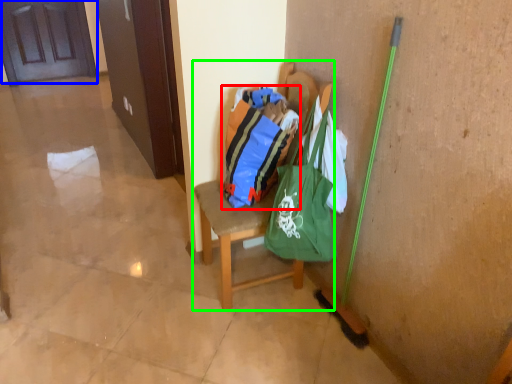
Question: Which object is the closest to the shopping bag (highlighted by a red box)? Choose among these: door (highlighted by a blue box) or chair (highlighted by a green box).

Choices:
 (A) door
 (B) chair

Answer: (B)